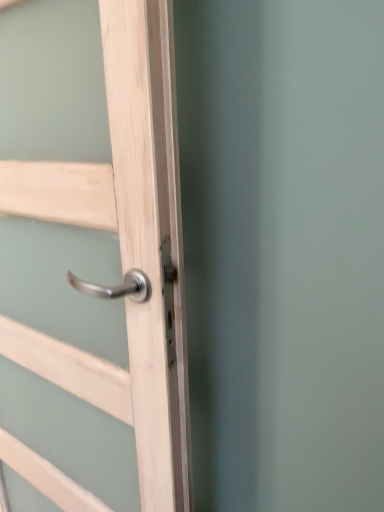
Where is `satin silver handle at center`? satin silver handle at center is located at coordinates (126, 250).

What do you see at coordinates (126, 250) in the screenshot? I see `satin silver handle at center` at bounding box center [126, 250].

Where is `satin silver handle at center`? satin silver handle at center is located at coordinates (126, 250).